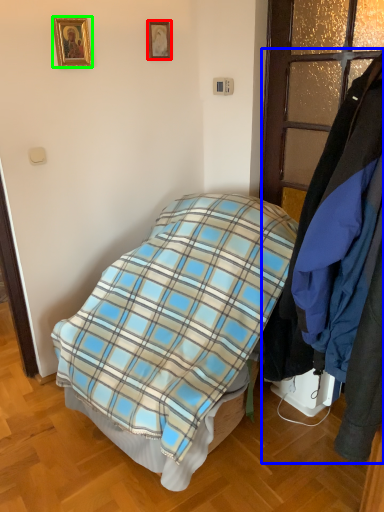
Question: Estimate the real-world distances between objects in this image. Which object is farther from picture frame (highlighted by a red box), closet (highlighted by a blue box) or picture frame (highlighted by a green box)?

Choices:
 (A) closet
 (B) picture frame

Answer: (A)